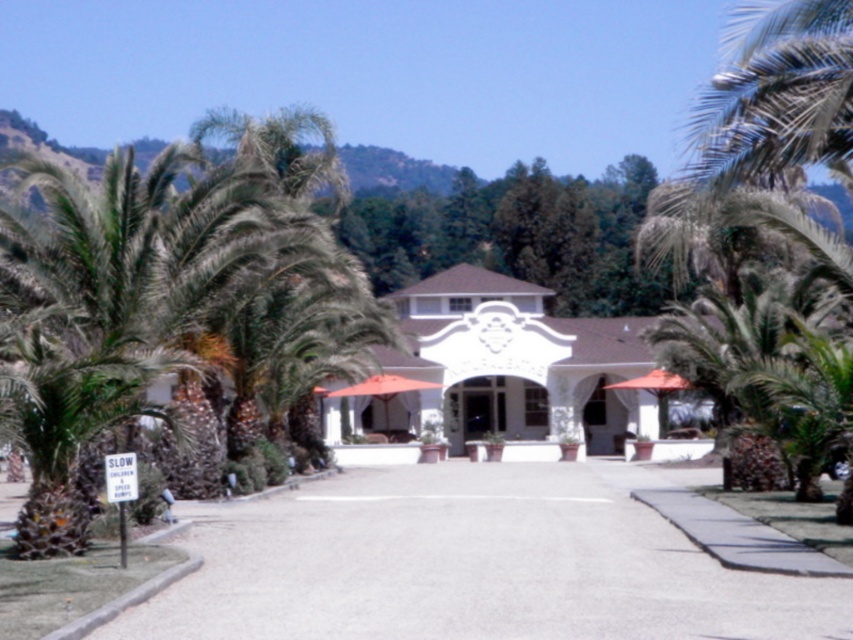
Is gray gravel road at lower left wider than white stucco building at center?

Incorrect, gray gravel road at lower left's width does not surpass white stucco building at center's.

Which of these two, gray gravel road at lower left or white stucco building at center, stands shorter?

gray gravel road at lower left

You are a GUI agent. You are given a task and a screenshot of the screen. Output one action in this format:
    pyautogui.click(x=<x>, y=<y>)
    Task: Click on the gray gravel road at lower left
    The image size is (853, 640).
    Given the screenshot: What is the action you would take?
    pyautogui.click(x=471, y=563)

Which is above, white stucco building at center or green leafy palm tree at right?

Positioned higher is green leafy palm tree at right.

Locate an element on the screen. The image size is (853, 640). white stucco building at center is located at coordinates (506, 368).

This screenshot has height=640, width=853. In order to click on white stucco building at center in this screenshot , I will do `click(506, 368)`.

Between point (520, 474) and point (817, 65), which one is positioned in front?

Point (817, 65) is in front.

Does gray gravel road at lower left appear under green leafy palm tree at right?

Yes.

This screenshot has height=640, width=853. I want to click on gray gravel road at lower left, so click(471, 563).